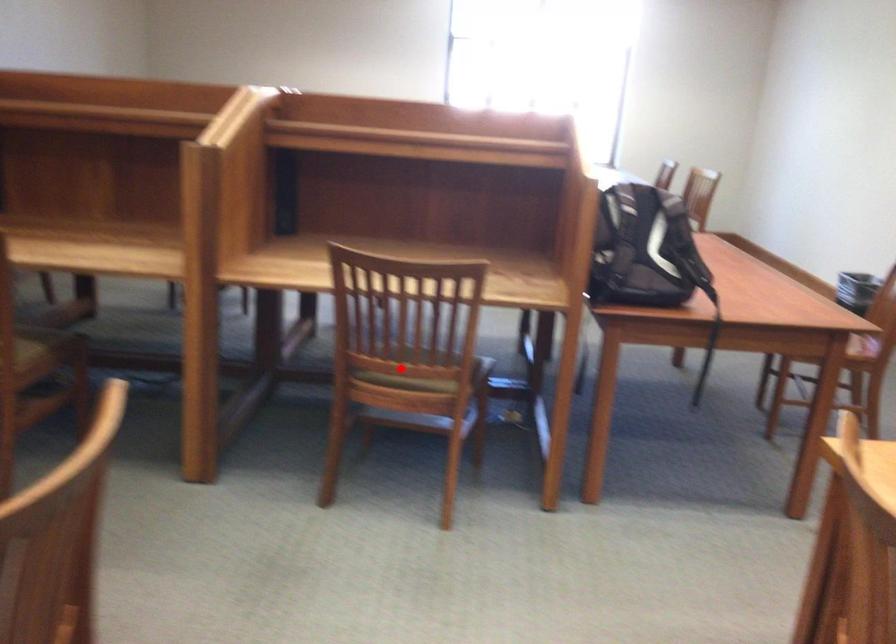
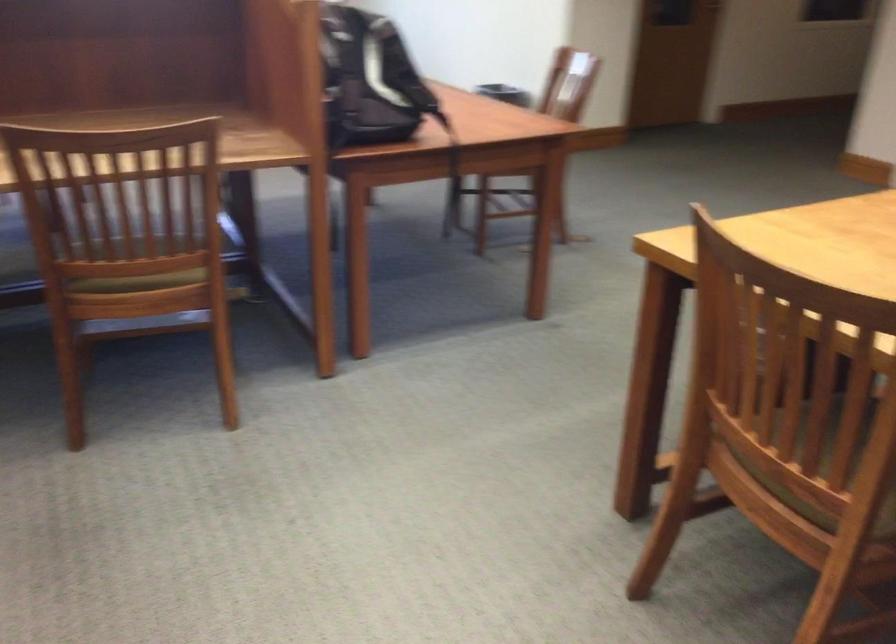
Where in the second image is the point corresponding to the highlighted location from the first image?

(139, 266)